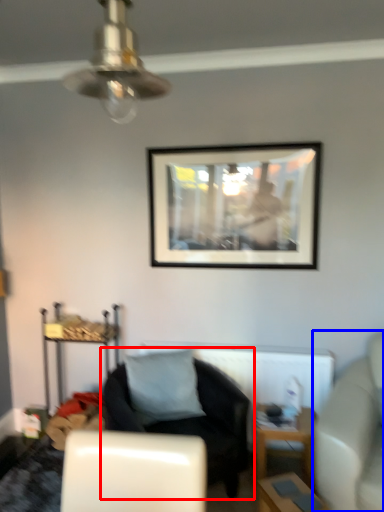
Question: Which object appears closest to the camera in this image, chair (highlighted by a red box) or studio couch (highlighted by a blue box)?

Choices:
 (A) chair
 (B) studio couch

Answer: (B)